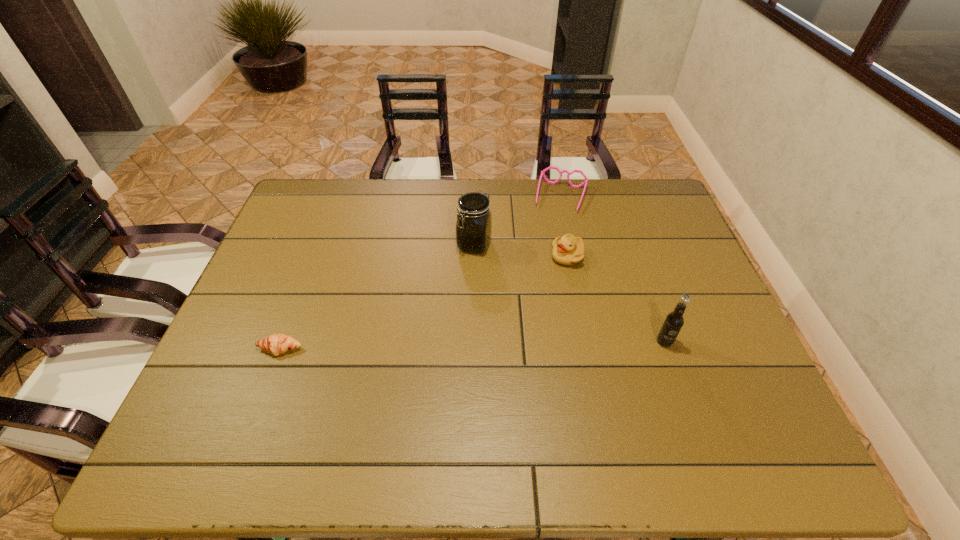
This screenshot has width=960, height=540. I want to click on vacant spot on the desktop that is between the leftmost object and the root beer and is positioned on the lid of the jar, so click(432, 346).

I want to click on free spot on the desktop that is between the shortest object and the rightmost object and is positioned on the arms of the farthest object, so click(521, 344).

Locate an element on the screen. The image size is (960, 540). vacant spot on the desktop that is between the shortest object and the rightmost object and is positioned on the front-facing side of the third tallest object is located at coordinates (466, 345).